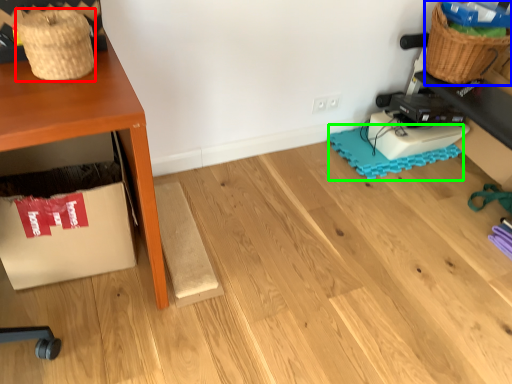
Question: Based on their relative distances, which object is farther from basket (highlighted by a red box)? Choose from basket (highlighted by a blue box) and mat (highlighted by a green box).

Choices:
 (A) basket
 (B) mat

Answer: (A)